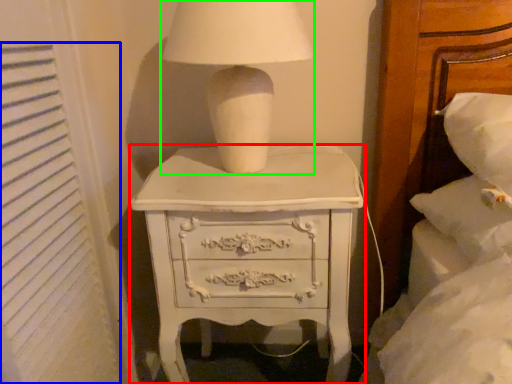
Question: Which object is the closest to the chest of drawers (highlighted by a red box)? Choose among these: curtain (highlighted by a blue box) or table lamp (highlighted by a green box).

Choices:
 (A) curtain
 (B) table lamp

Answer: (B)